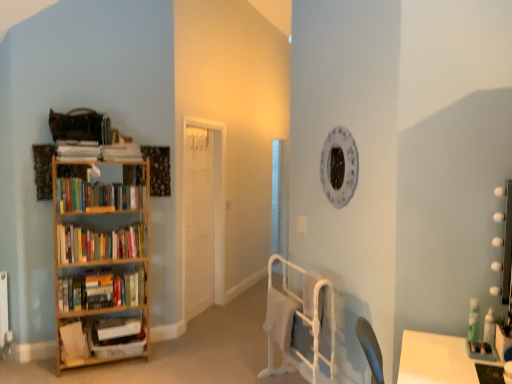
This screenshot has height=384, width=512. I want to click on blank space to the left of white matte bookshelf at left, which ranks as the 2th book in bottom-to-top order, so click(x=46, y=373).